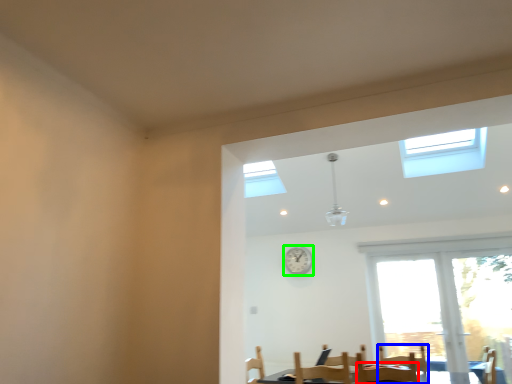
Question: Considering the real-world distances, which object is closest to chair (highlighted by a red box)? armchair (highlighted by a blue box) or clock (highlighted by a green box).

Choices:
 (A) armchair
 (B) clock

Answer: (A)